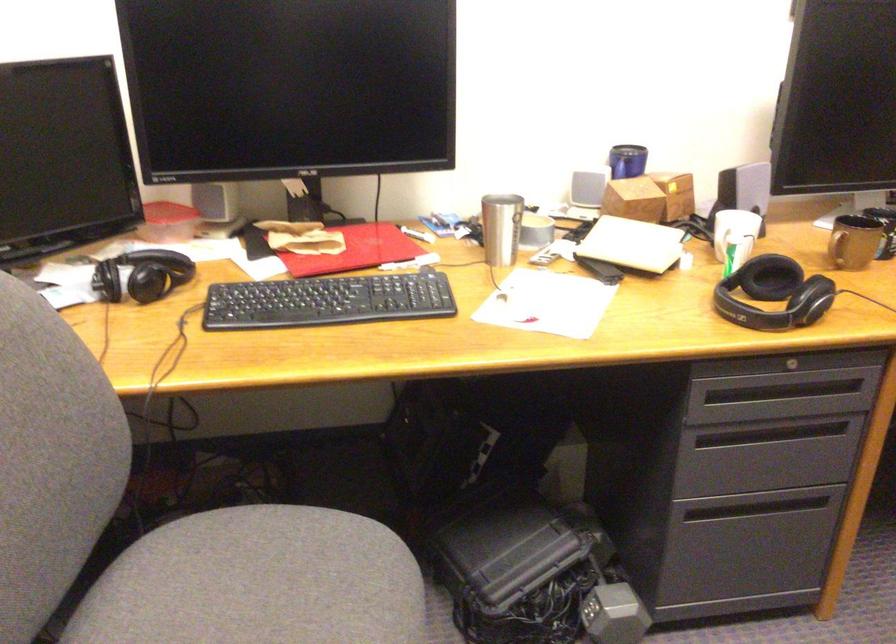
Identify the location of gray drawer handle. The height and width of the screenshot is (644, 896). (794, 365).